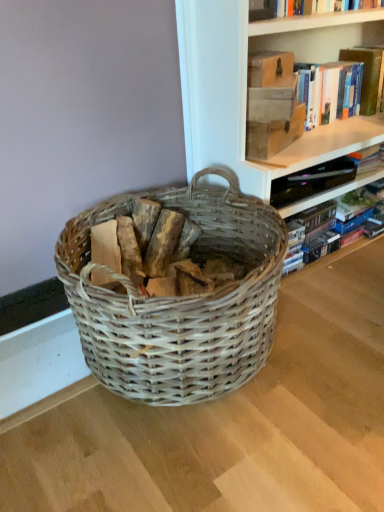
Locate an element on the screen. This screenshot has width=384, height=512. free spot in front of woven wood basket at center is located at coordinates (193, 455).